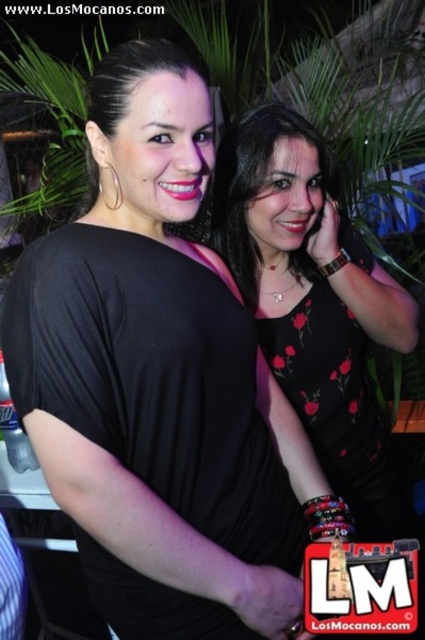
Is black floral dress at center thinner than matte black dress at center?

In fact, black floral dress at center might be wider than matte black dress at center.

Is black floral dress at center in front of matte black dress at center?

No, black floral dress at center is further to the viewer.

Is point (274, 333) farther from viewer compared to point (113, 54)?

Yes, it is.

Find the location of `black floral dress at center`. black floral dress at center is located at coordinates (337, 404).